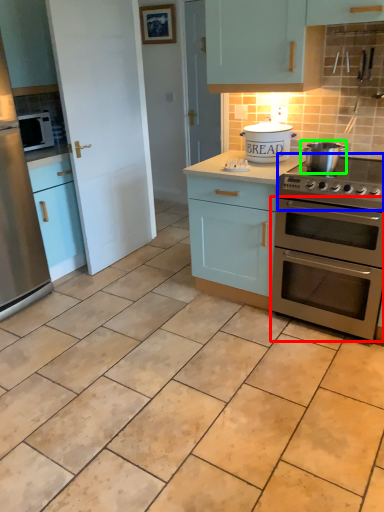
Question: Which is nearer to the oven (highlighted by a red box)? gas stove (highlighted by a blue box) or appliance (highlighted by a green box).

Choices:
 (A) gas stove
 (B) appliance

Answer: (A)